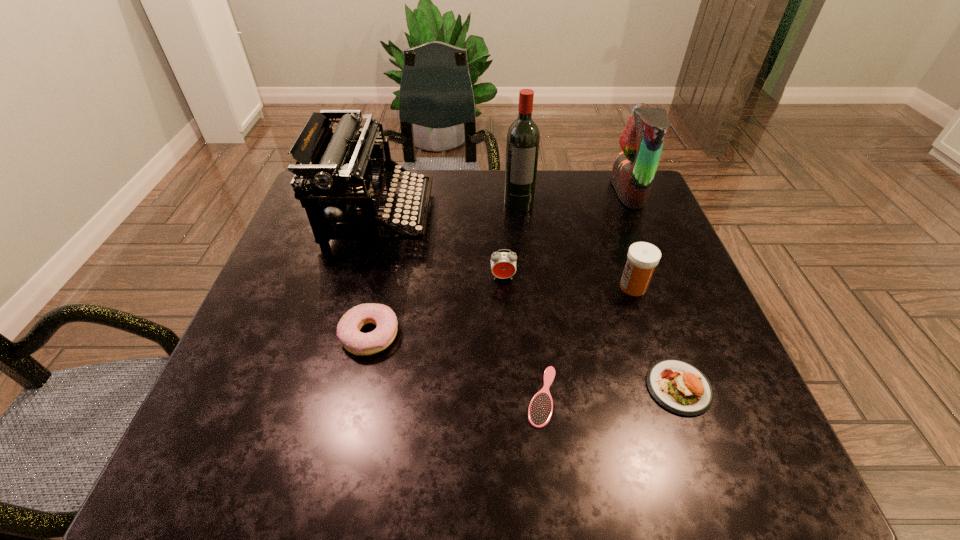
At what (x,y) coordinates should I click in order to perform the action: click on vacant space that is in between the hairbrush and the typewriter. Please return your answer as a coordinate pair (x, y). Looking at the image, I should click on (460, 306).

Locate an element on the screen. This screenshot has height=540, width=960. vacant space in between the patty (food) and the fourth shortest object is located at coordinates (590, 333).

At what (x,y) coordinates should I click in order to perform the action: click on free point between the typewriter and the shortest object. Please return your answer as a coordinate pair (x, y). Looking at the image, I should click on (460, 306).

Find the location of a particular element. Image resolution: width=960 pixels, height=540 pixels. free space between the typewriter and the second shortest object is located at coordinates (528, 302).

I want to click on the closest object to the shortest object, so click(x=679, y=387).

You are a GUI agent. You are given a task and a screenshot of the screen. Output one action in this format:
    pyautogui.click(x=<x>, y=<y>)
    Task: Click on the fourth closest object to the medicine
    
    Given the screenshot: What is the action you would take?
    pyautogui.click(x=642, y=140)

The width and height of the screenshot is (960, 540). Find the location of `vacant space that satisfies the following two spatial constraints: 1. on the face of the medicine; 2. on the left side of the alarm clock`. vacant space that satisfies the following two spatial constraints: 1. on the face of the medicine; 2. on the left side of the alarm clock is located at coordinates (503, 287).

Where is `free space that satisfies the following two spatial constraints: 1. on the face of the fifth tallest object; 2. on the right side of the seventh tallest object`? Image resolution: width=960 pixels, height=540 pixels. free space that satisfies the following two spatial constraints: 1. on the face of the fifth tallest object; 2. on the right side of the seventh tallest object is located at coordinates (509, 388).

Locate an element on the screen. The width and height of the screenshot is (960, 540). free space that satisfies the following two spatial constraints: 1. on the back side of the doughnut; 2. on the typing side of the typewriter is located at coordinates (396, 216).

This screenshot has width=960, height=540. In order to click on free space that satisfies the following two spatial constraints: 1. on the label of the wine bottle; 2. on the typing side of the typewriter in this screenshot , I will do `click(520, 216)`.